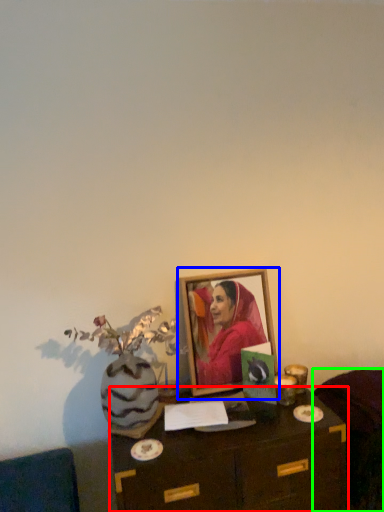
Question: Estimate the real-world distances between objects in this image. Which object is farther from table (highlighted by a red box), picture frame (highlighted by a blue box) or furniture (highlighted by a green box)?

Choices:
 (A) picture frame
 (B) furniture

Answer: (A)